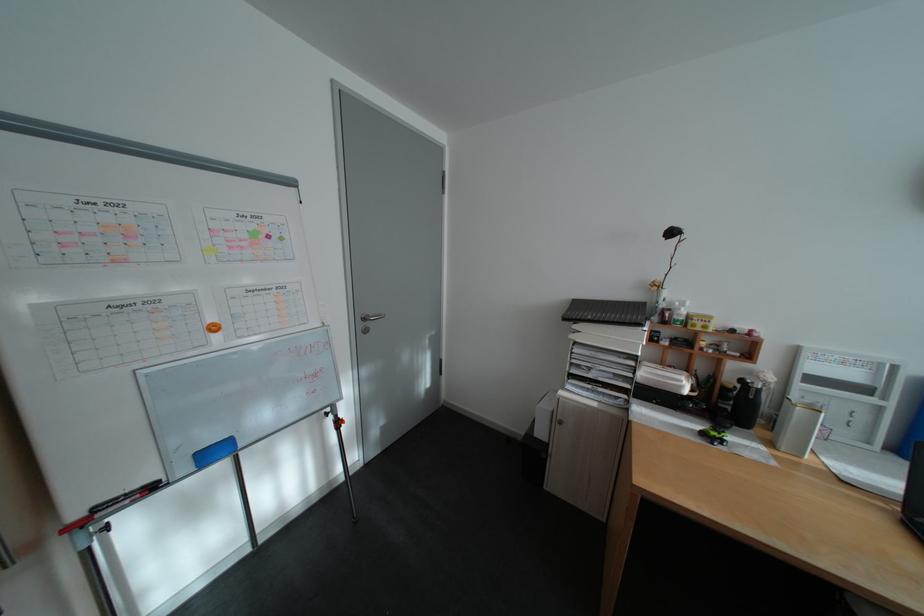
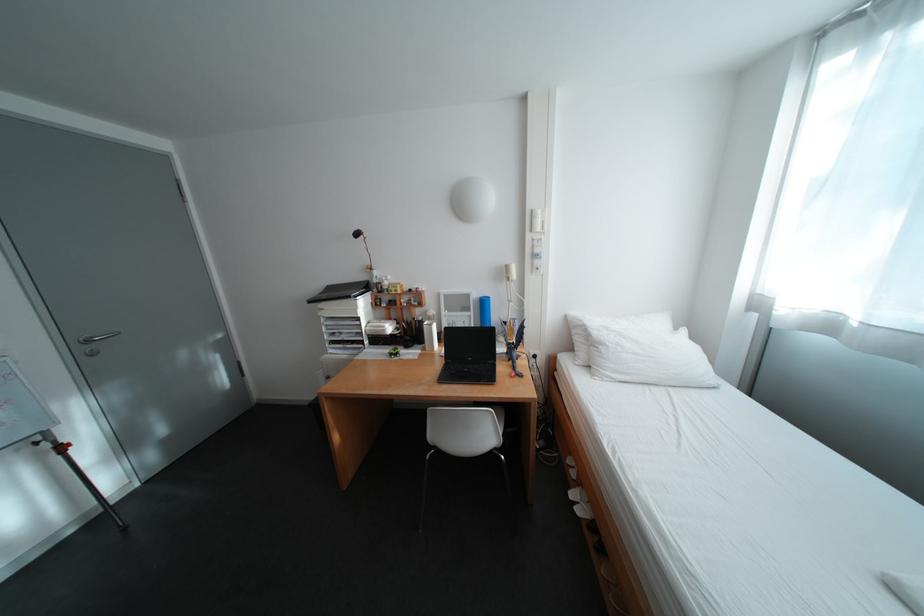
The point at (604, 373) is marked in the first image. Where is the corresponding point in the second image?

(355, 336)